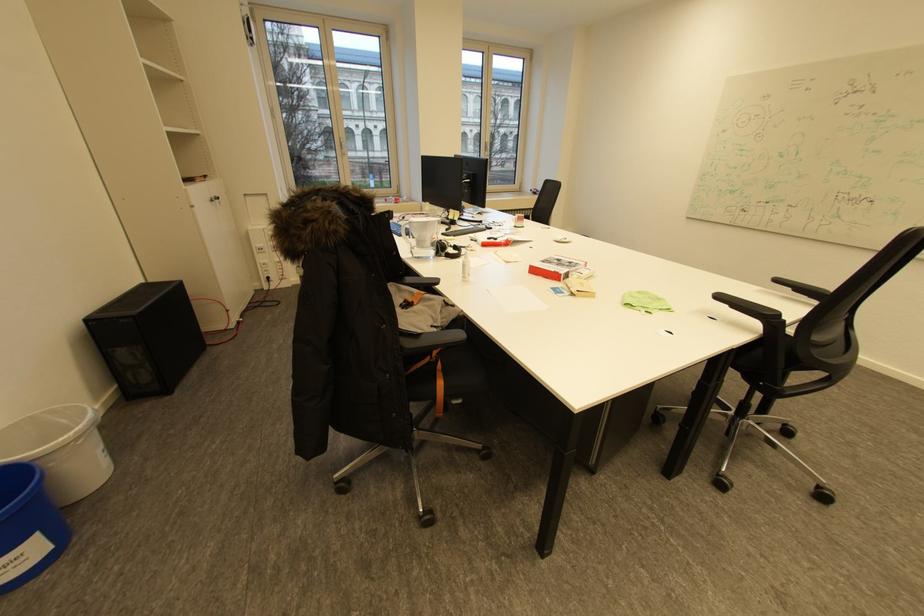
What do you see at coordinates (214, 198) in the screenshot? I see `the white cabinet handle` at bounding box center [214, 198].